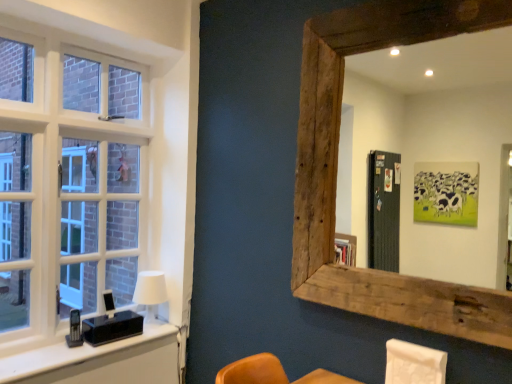
Question: Does point (152, 286) appear closer or farther from the camera than point (424, 377)?

Choices:
 (A) farther
 (B) closer

Answer: (A)

Question: Considering their positions, is white matte table lamp at left located in front of or behind white fabric swivel chair at lower right?

Choices:
 (A) behind
 (B) front

Answer: (A)

Question: Estimate the real-world distances between objects in this image. Which object is closer to the rustic wood mirror at upper right?

Choices:
 (A) white wood window at left
 (B) black plastic vanity at left
 (C) white matte table lamp at left
 (D) white fabric swivel chair at lower right

Answer: (A)

Question: Estimate the real-world distances between objects in this image. Which object is farther from the white matte table lamp at left?

Choices:
 (A) rustic wood mirror at upper right
 (B) white wood window at left
 (C) white fabric swivel chair at lower right
 (D) black plastic vanity at left

Answer: (A)